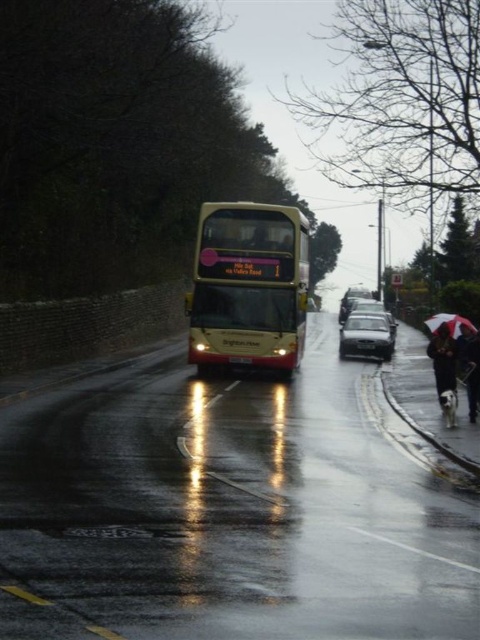
Is gold metallic bus at center smaller than white fabric umbrella at lower right?

Actually, gold metallic bus at center might be larger than white fabric umbrella at lower right.

Consider the image. Does gold metallic bus at center have a lesser width compared to white fabric umbrella at lower right?

Yes.

Identify the location of gold metallic bus at center. (249, 285).

You are a GUI agent. You are given a task and a screenshot of the screen. Output one action in this format:
    pyautogui.click(x=<x>, y=<y>)
    Task: Click on the gold metallic bus at center
    
    Given the screenshot: What is the action you would take?
    pyautogui.click(x=249, y=285)

Between gold metallic bus at center and shiny metallic sedan at center-right, which one is positioned lower?

shiny metallic sedan at center-right is lower down.

Is point (292, 285) positioned behind point (368, 353)?

No.

Between point (215, 340) and point (374, 346), which one is positioned behind?

The point (374, 346) is behind.

This screenshot has height=640, width=480. Find the location of `gold metallic bus at center`. gold metallic bus at center is located at coordinates (249, 285).

The width and height of the screenshot is (480, 640). I want to click on white umbrella at right, so click(443, 360).

At what (x,y) coordinates should I click in order to perform the action: click on white umbrella at right. Please return your answer as a coordinate pair (x, y). Looking at the image, I should click on (443, 360).

Locate an element on the screen. The width and height of the screenshot is (480, 640). white umbrella at right is located at coordinates (x=443, y=360).